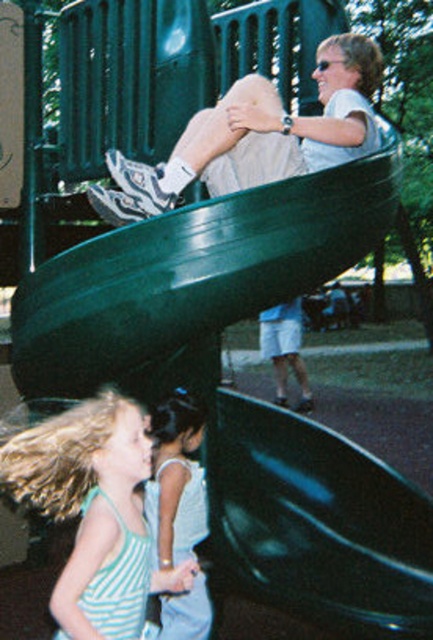
Question: Considering the real-world distances, which object is farthest from the matte white sneakers at upper center?

Choices:
 (A) white satin dress at lower center
 (B) striped fabric dress at lower left

Answer: (B)

Question: Can you confirm if matte white sneakers at upper center is bigger than white satin dress at lower center?

Choices:
 (A) yes
 (B) no

Answer: (A)

Question: Does striped fabric dress at lower left lie in front of matte white sneakers at upper center?

Choices:
 (A) yes
 (B) no

Answer: (A)

Question: Is striped fabric dress at lower left smaller than matte white sneakers at upper center?

Choices:
 (A) no
 (B) yes

Answer: (B)

Question: Among these objects, which one is farthest from the camera?

Choices:
 (A) matte white sneakers at upper center
 (B) striped fabric dress at lower left

Answer: (A)

Question: Which of the following is the closest to the observer?

Choices:
 (A) white satin dress at lower center
 (B) matte white sneakers at upper center
 (C) striped fabric dress at lower left

Answer: (C)